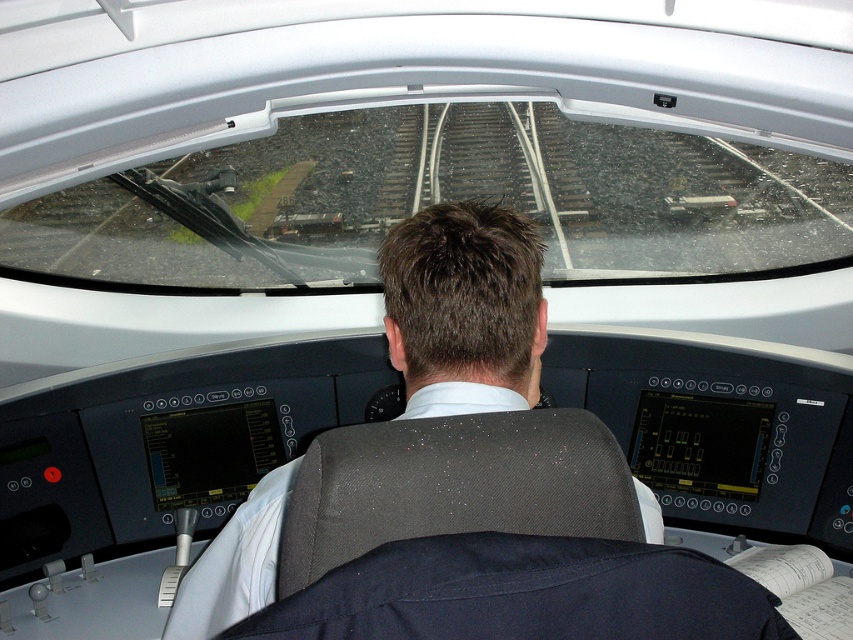
In the scene shown: Does dark blue fabric at center have a greater height compared to dark gray fabric at center?

No.

Is point (590, 576) closer to camera compared to point (474, 262)?

Yes, it is in front of point (474, 262).

At what (x,y) coordinates should I click in order to perform the action: click on dark blue fabric at center. Please return your answer as a coordinate pair (x, y). Looking at the image, I should click on (523, 593).